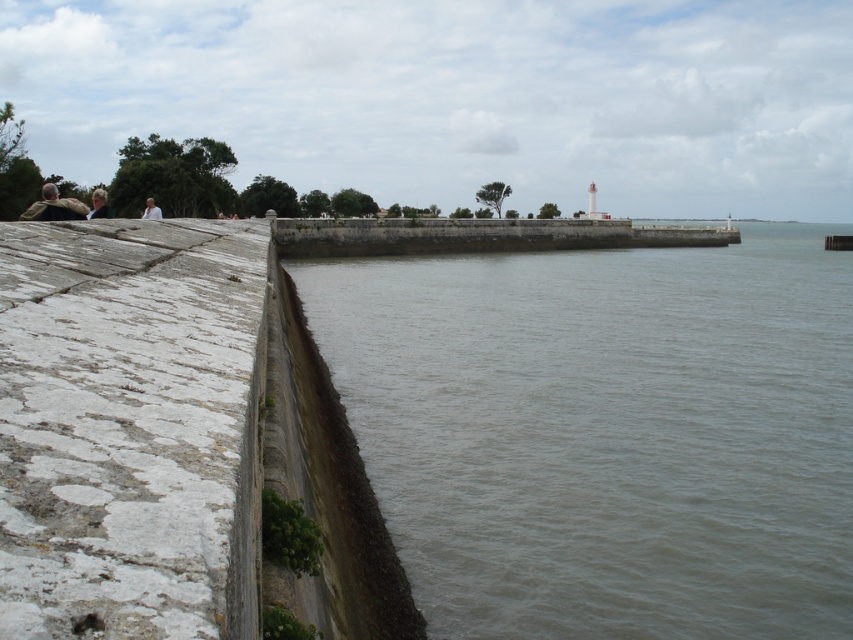
Is gray concrete water at center below light brown hair at upper left?

Correct, gray concrete water at center is located below light brown hair at upper left.

Is gray concrete water at center thinner than light brown hair at upper left?

In fact, gray concrete water at center might be wider than light brown hair at upper left.

Which is behind, point (444, 323) or point (102, 188)?

Point (102, 188)

Where is `gray concrete water at center`? This screenshot has width=853, height=640. gray concrete water at center is located at coordinates (606, 433).

Does point (94, 209) come farther from viewer compared to point (146, 205)?

No, (94, 209) is closer to viewer.

Based on the photo, can you confirm if light brown hair at upper left is positioned above white fabric at upper left?

Incorrect, light brown hair at upper left is not positioned above white fabric at upper left.

Does point (107, 214) lie behind point (149, 211)?

No, (107, 214) is closer to viewer.

Locate an element on the screen. light brown hair at upper left is located at coordinates (99, 204).

Consider the image. Does camouflage jacket at left appear on the right side of light brown hair at upper left?

No, camouflage jacket at left is not to the right of light brown hair at upper left.

Does camouflage jacket at left appear on the left side of light brown hair at upper left?

Correct, you'll find camouflage jacket at left to the left of light brown hair at upper left.

Is point (33, 220) closer to camera compared to point (102, 196)?

Yes, it is in front of point (102, 196).

Identify the location of camouflage jacket at left. (54, 205).